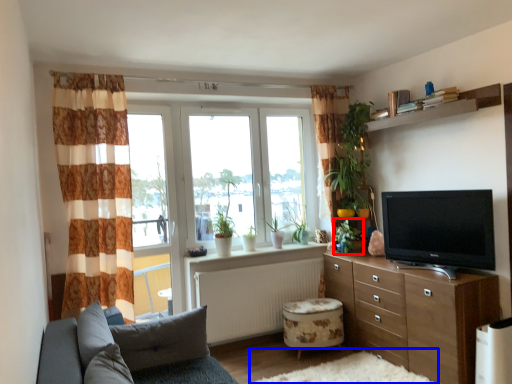
Question: Which point is further to the camera, plant (highlighted by a red box) or plain (highlighted by a blue box)?

Choices:
 (A) plant
 (B) plain

Answer: (A)